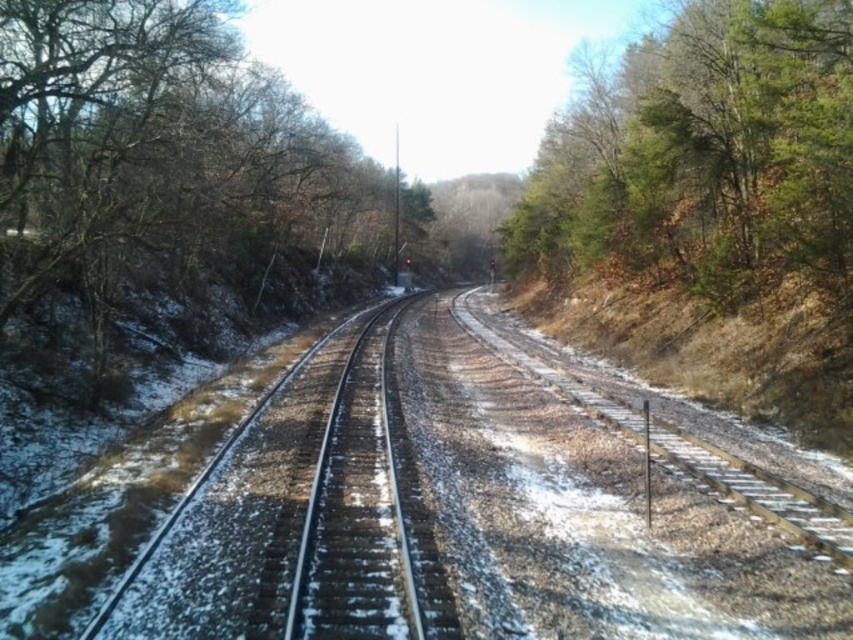
You are standing on the railway tracks and looking towards the forest. Which object, the bare branches at left or the green leafy tree at right, is positioned higher in your field of view?

The bare branches at left is located above the green leafy tree at right, so it is higher in your field of view.

You are a hiker who wants to cross the railway tracks. You see the bare branches at left and the green leafy tree at right. Which tree would you choose to use as a landmark to remember the crossing? Why?

The bare branches at left is larger in size than the green leafy tree at right, so it would be more noticeable and easier to remember as a landmark.